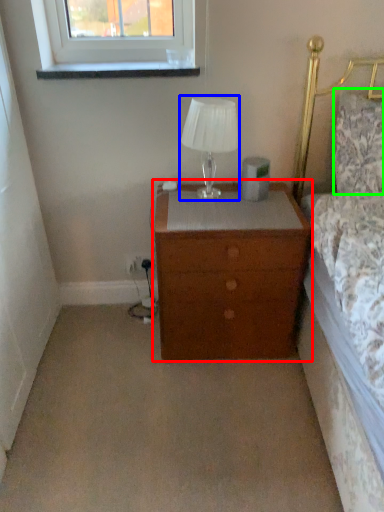
Question: Based on their relative distances, which object is farther from nightstand (highlighted by a red box)? Choose from table lamp (highlighted by a blue box) and pillow (highlighted by a green box).

Choices:
 (A) table lamp
 (B) pillow

Answer: (B)